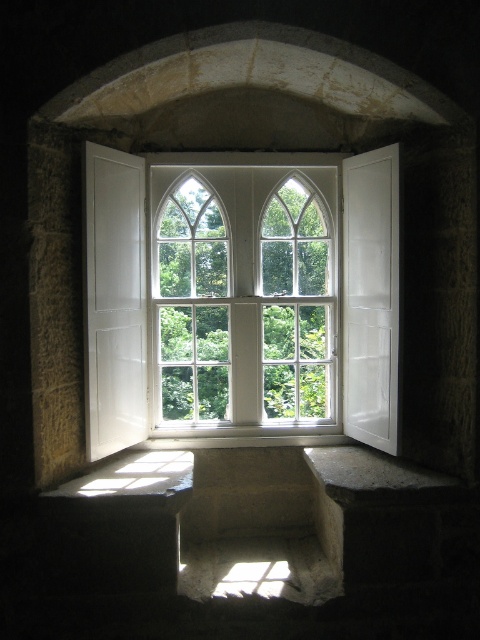
Question: Which point is closer to the camera?

Choices:
 (A) white glass window at center
 (B) white wooden bay window at center

Answer: (B)

Question: Does white wooden bay window at center appear under white glass window at center?

Choices:
 (A) no
 (B) yes

Answer: (B)

Question: Is white wooden bay window at center to the right of white glass window at center from the viewer's perspective?

Choices:
 (A) yes
 (B) no

Answer: (B)

Question: From the image, what is the correct spatial relationship of white wooden bay window at center in relation to white glass window at center?

Choices:
 (A) below
 (B) above

Answer: (A)

Question: Which of the following is the closest to the observer?

Choices:
 (A) (327, 193)
 (B) (179, 260)

Answer: (A)